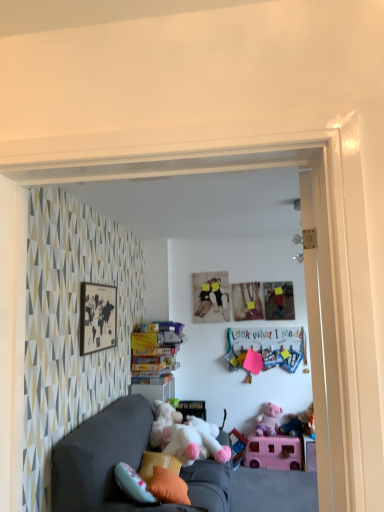
Question: Is matte gray couch at lower center wider or thinner than matte pink paper at upper center?

Choices:
 (A) thin
 (B) wide

Answer: (B)

Question: Is matte gray couch at lower center taller or shorter than matte pink paper at upper center?

Choices:
 (A) tall
 (B) short

Answer: (B)

Question: Based on their relative distances, which object is nearer to the purple plush bear at lower right, the fourth toy in the front-to-back sequence?

Choices:
 (A) fluffy pink teddy bear at lower right, which is counted as the second toy, starting from the back
 (B) fluffy white plush at center, the first toy positioned from the front
 (C) velvet dark gray couch at center
 (D) pink plastic toy car at lower right, which ranks as the third toy in back-to-front order
 (E) matte black map at upper left

Answer: (A)

Question: Estimate the real-world distances between objects in this image. Which object is closer to the fluffy pink teddy bear at lower right, which is counted as the second toy, starting from the back?

Choices:
 (A) fluffy white plush at center, positioned as the 4th toy in back-to-front order
 (B) matte gray couch at lower center
 (C) purple plush bear at lower right, the fourth toy in the front-to-back sequence
 (D) velvet dark gray couch at center
 (E) orange fabric pillow at lower center, the 1th pillow from the back

Answer: (C)